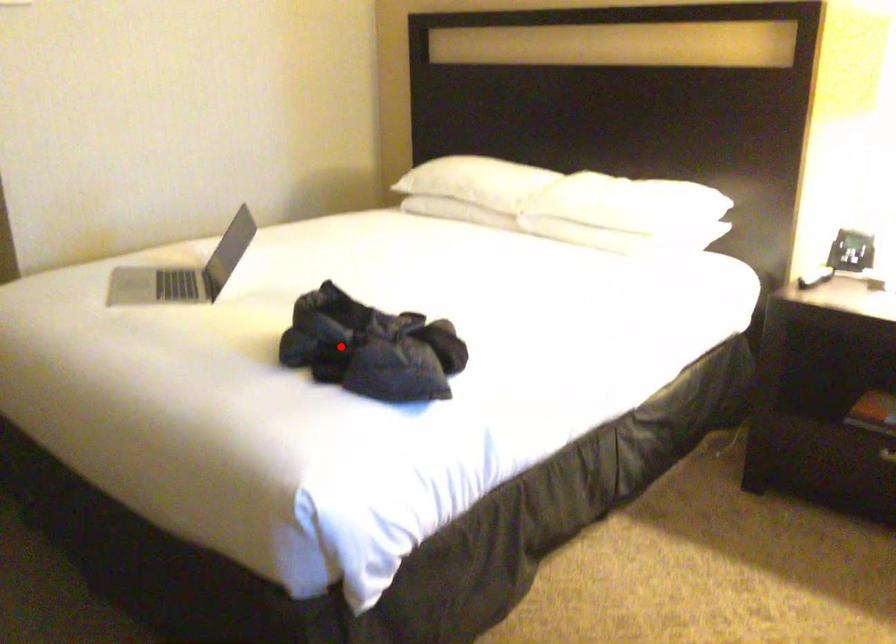
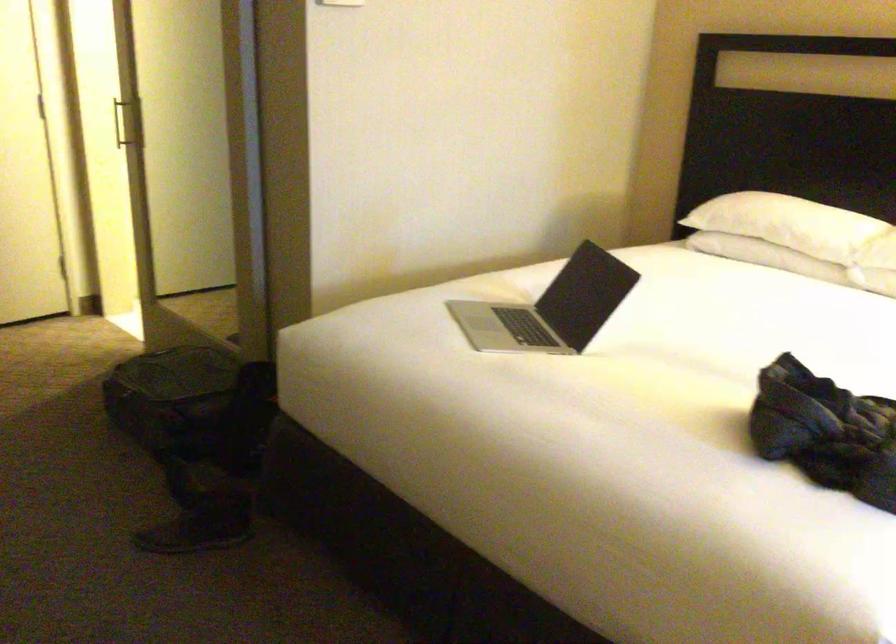
Question: I am providing you with two images of the same scene from different viewpoints. Image1 has a red point marked. In image2, the corresponding 3D location appears at what relative position? Reply with the corresponding letter.

Choices:
 (A) Closer
 (B) Farther

Answer: (A)